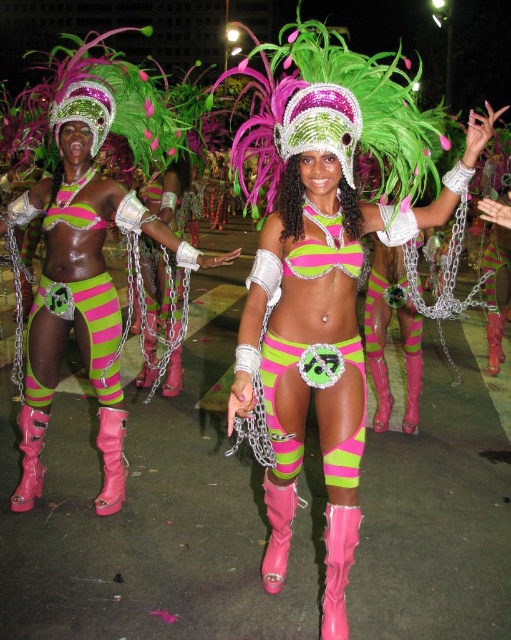
You are a costume designer observing the neon green matte bikini top at upper center and the pink matte bikini top at center. Which one has a greater width?

The neon green matte bikini top at upper center has a greater width than the pink matte bikini top at center.

You are a photographer at the carnival trying to capture both the neon green matte bikini top at center and the other individual wearing the same outfit. How far apart are they from each other?

The two individuals wearing the neon green matte bikini top at center are 1.82 meters apart.